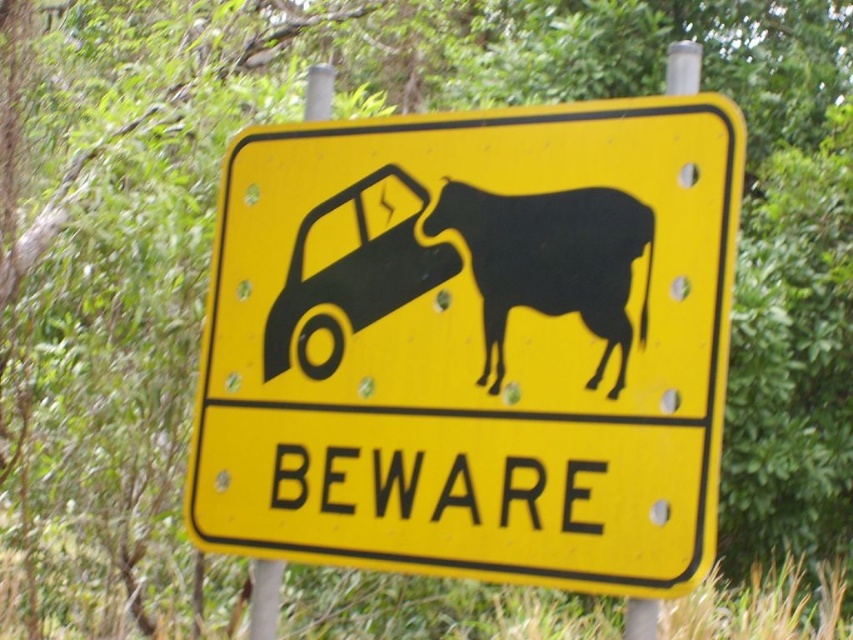
You are standing in front of the yellow road sign with the car and cow illustration. There are two points marked on the sign. Which point, point 1 at coordinates [561,301] or point 2 at coordinates [288,317], is closer to you?

Point 1 at coordinates [561,301] is closer to the viewer than point 2 at coordinates [288,317].

You are driving a car and see the yellow matte sign at center and the black matte car at left on the road. Which object is wider?

The yellow matte sign at center is wider than the black matte car at left according to the description.